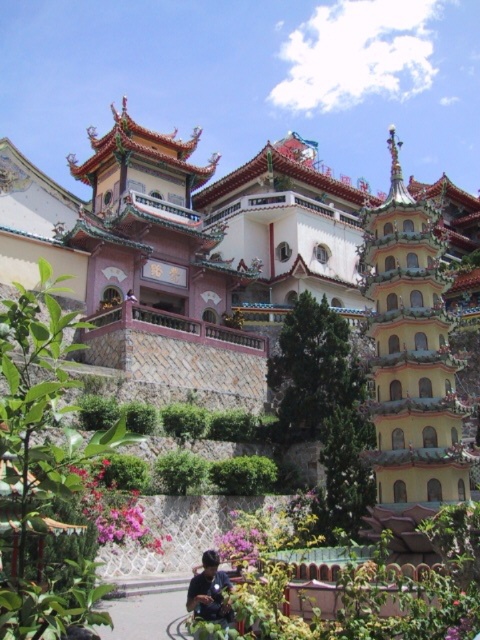
You are standing in front of the temple structure and notice a specific point marked at coordinates point (x=116, y=506). Based on the scene description, can you identify what this point corresponds to?

The point (x=116, y=506) is located on the pink matte flowers at lower center.

You are an architect visiting this temple and notice the yellow glazed pagoda at right and the matte black shirt at lower center. Which object is wider?

The yellow glazed pagoda at right is wider than the matte black shirt at lower center.